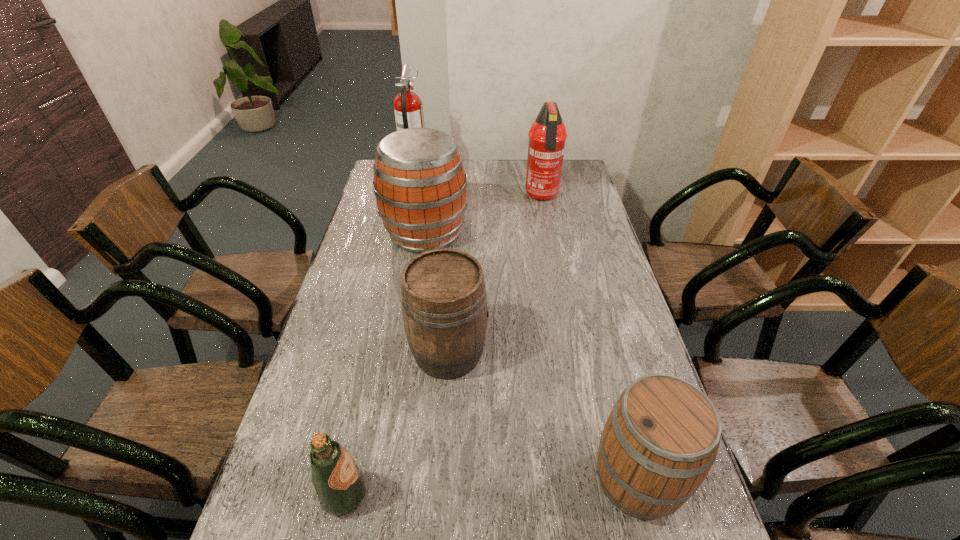
This screenshot has height=540, width=960. Identify the location of free space that satisfies the following two spatial constraints: 1. on the trigger side of the nearer fire extinguisher; 2. on the right side of the nearest cider. (597, 480).

Locate an element on the screen. The width and height of the screenshot is (960, 540). vacant area that satisfies the following two spatial constraints: 1. on the trigger side of the nearer fire extinguisher; 2. on the side of the second farthest cider near the bung hole is located at coordinates (572, 353).

Identify the location of free space that satisfies the following two spatial constraints: 1. on the trigger side of the right fire extinguisher; 2. on the side of the fourth farthest object near the bung hole. (572, 353).

You are a GUI agent. You are given a task and a screenshot of the screen. Output one action in this format:
    pyautogui.click(x=<x>, y=<y>)
    Task: Click on the free space that satisfies the following two spatial constraints: 1. on the trigger side of the nearer fire extinguisher; 2. on the front-facing side of the olive oil
    
    Given the screenshot: What is the action you would take?
    pyautogui.click(x=600, y=495)

Image resolution: width=960 pixels, height=540 pixels. Identify the location of free space that satisfies the following two spatial constraints: 1. on the back side of the rightmost cider; 2. on the nozzle side of the farthest object. (557, 172).